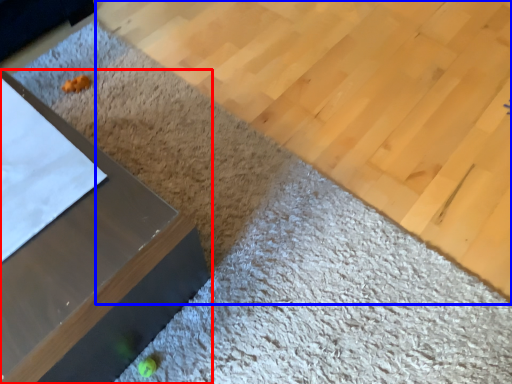
Question: Which object is closer to the camera taking this photo, furniture (highlighted by a red box) or plywood (highlighted by a blue box)?

Choices:
 (A) furniture
 (B) plywood

Answer: (A)